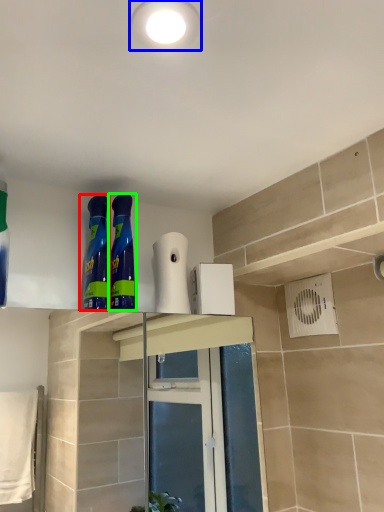
Question: Which object is positioned farthest from cleaning product (highlighted by a red box)? Select from lighting (highlighted by a blue box) and cleaning product (highlighted by a green box).

Choices:
 (A) lighting
 (B) cleaning product

Answer: (A)